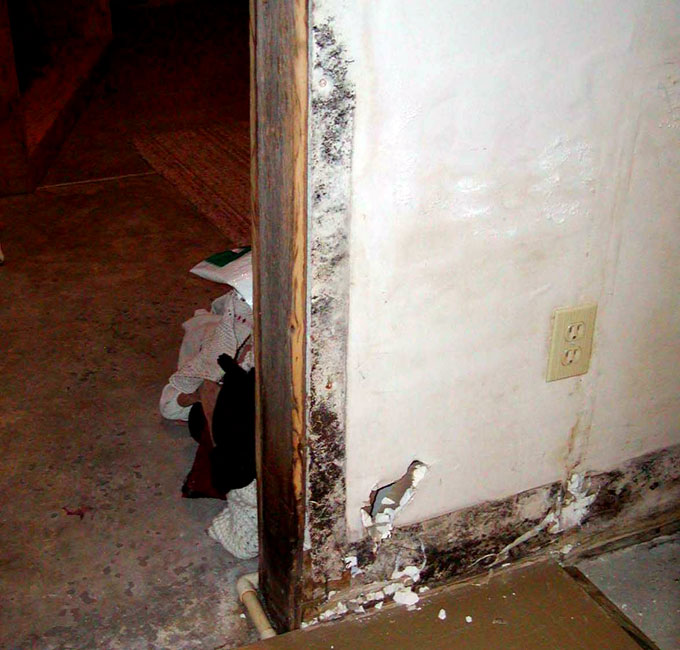
This screenshot has width=680, height=650. Find the location of `rug, red or pink colored`. rug, red or pink colored is located at coordinates (211, 161).